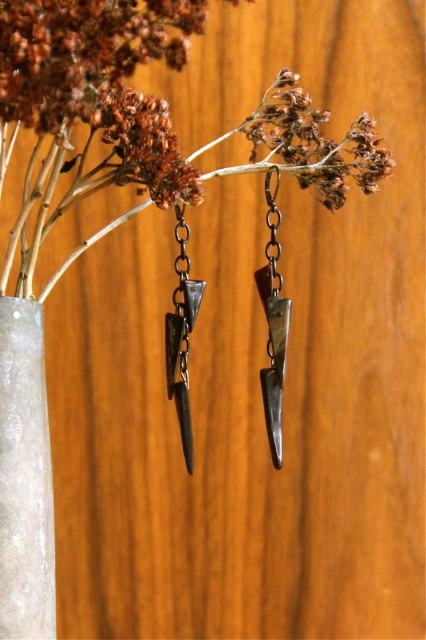
Question: Which point is farther to the camera?

Choices:
 (A) clear glass vase at left
 (B) matte silver earring at center
 (C) brown matte flower at upper center

Answer: (B)

Question: Is brown matte flower at upper center closer to camera compared to matte silver earring at center?

Choices:
 (A) no
 (B) yes

Answer: (B)

Question: Is matte silver spike at center above matte silver earring at center?

Choices:
 (A) yes
 (B) no

Answer: (A)

Question: Which point appears closest to the camera in this image?

Choices:
 (A) tap(173, 333)
 (B) tap(190, 180)

Answer: (B)

Question: Does clear glass vase at left appear on the right side of brown matte flower at upper center?

Choices:
 (A) no
 (B) yes

Answer: (A)

Question: Among these points, which one is farthest from the camera?

Choices:
 (A) (160, 160)
 (B) (183, 312)

Answer: (B)